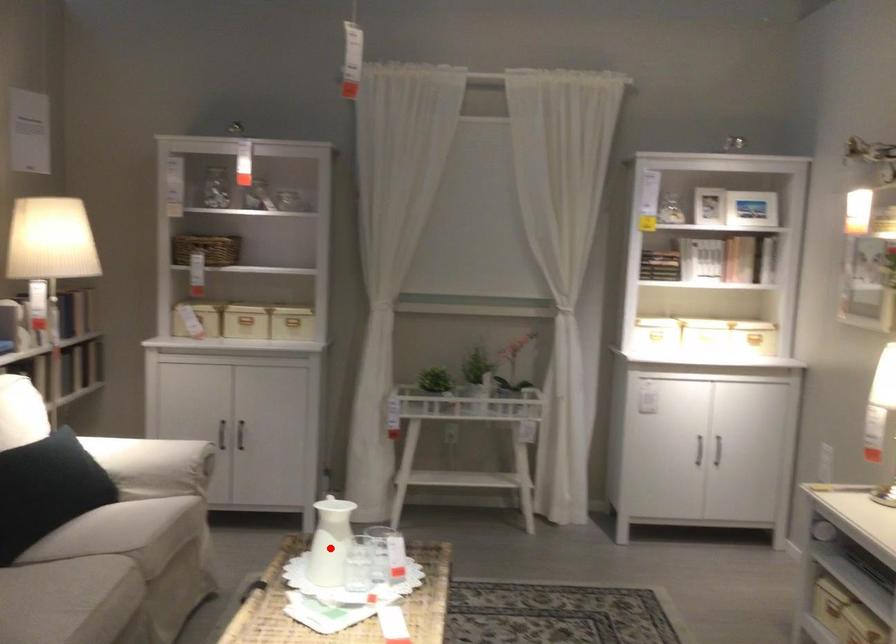
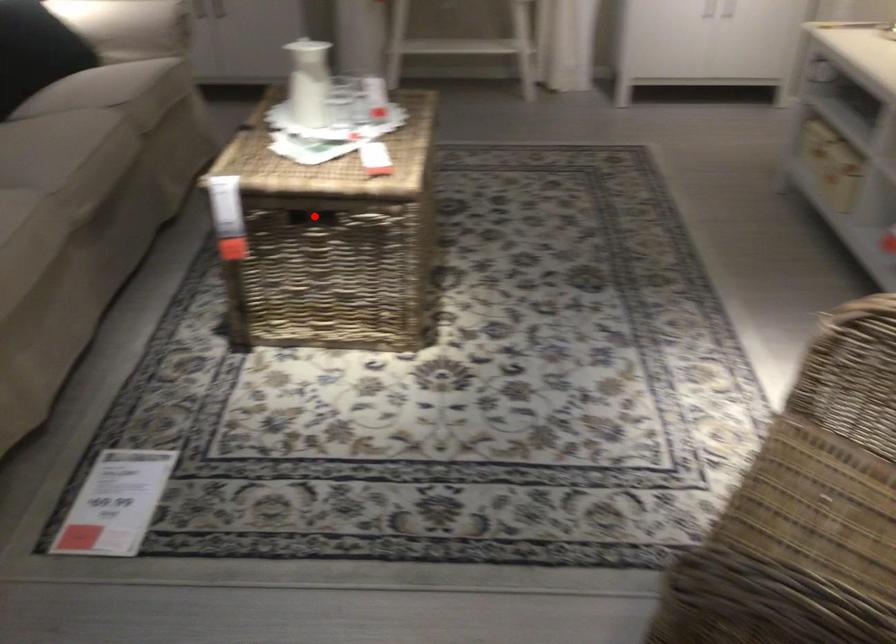
I am providing you with two images of the same scene from different viewpoints. A red point is marked on the first image and another point is marked on the second image. Does the point marked in image1 correspond to the same location as the one in image2?

No